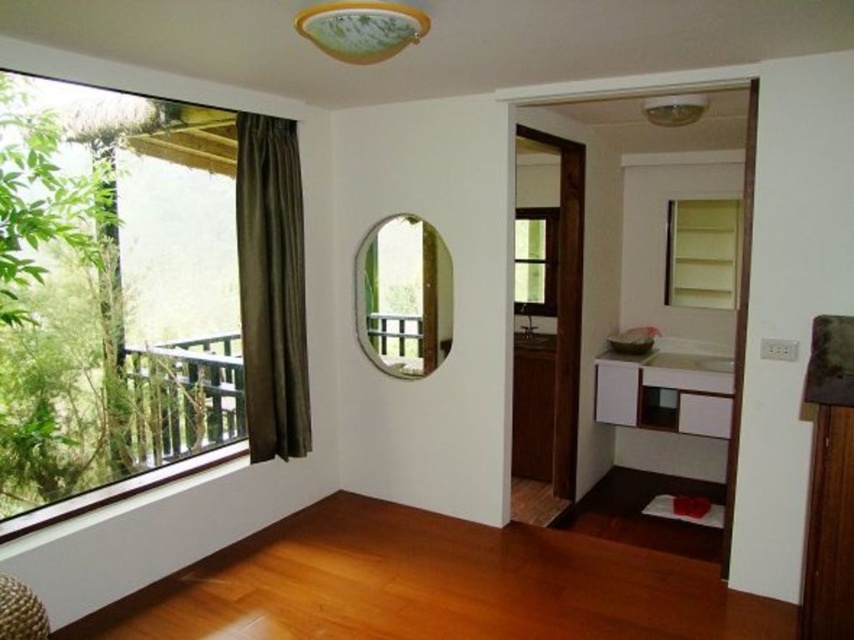
You are an interior designer planning to install a new decorative item. You have two options to choose from. The first option is a large sculpture that requires a space larger than the transparent glass window at left. The second option is a smaller sculpture that needs a space larger than the clear glass mirror at center. Based on the sizes of the objects in the scene, which sculpture can you place in the room?

The transparent glass window at left is bigger than the clear glass mirror at center. Therefore, the large sculpture requiring a space larger than the transparent glass window at left cannot be placed, but the smaller sculpture needing a space larger than the clear glass mirror at center can be accommodated.

You are standing in the room described in the scene. There is a point labeled at coordinates (272, 288). What object is located at that point?

The point at coordinates (272, 288) indicates the green velvet curtain at left.

You are standing in the room and want to look outside through the transparent glass window at left. However, the clear glass mirror at center is blocking your view. How can you adjust your position to see outside without moving the mirror?

Since the transparent glass window at left is positioned under the clear glass mirror at center, you can lower your head or crouch down to look under the mirror and see outside through the window.